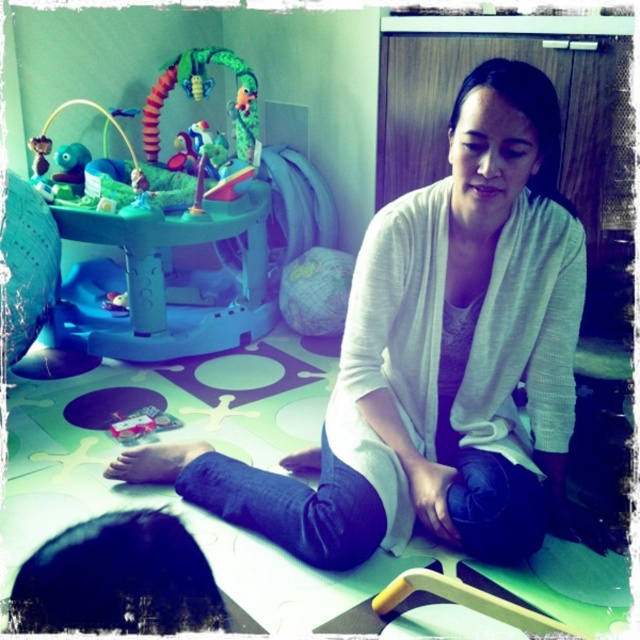
I want to click on teal plastic baby bouncer at upper left, so click(x=177, y=230).

Based on the photo, who is more forward, (132, 259) or (132, 433)?

Point (132, 433)

Where is `teal plastic baby bouncer at upper left`? teal plastic baby bouncer at upper left is located at coordinates (177, 230).

What do you see at coordinates (116, 579) in the screenshot? Image resolution: width=640 pixels, height=640 pixels. I see `dark blue fabric at lower left` at bounding box center [116, 579].

Does dark blue fabric at lower left appear over metallic pink toy at lower center?

Yes, dark blue fabric at lower left is above metallic pink toy at lower center.

The height and width of the screenshot is (640, 640). What do you see at coordinates (116, 579) in the screenshot?
I see `dark blue fabric at lower left` at bounding box center [116, 579].

This screenshot has width=640, height=640. Identify the location of dark blue fabric at lower left. (116, 579).

Who is more distant from viewer, (456, 234) or (132, 429)?

Point (132, 429)

Does white sweater at center have a smaller size compared to metallic pink toy at lower center?

Actually, white sweater at center might be larger than metallic pink toy at lower center.

Does point (570, 225) lie behind point (115, 436)?

No, it is not.

This screenshot has width=640, height=640. Identify the location of white sweater at center. (435, 362).